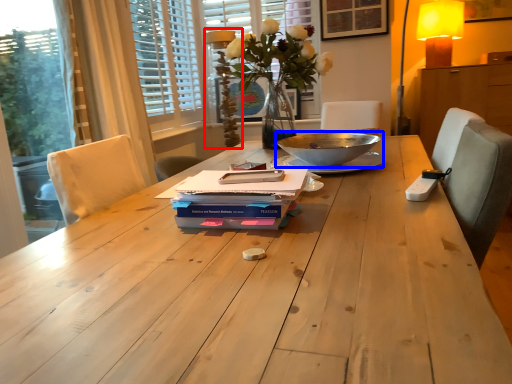
Question: Which object appears farthest to the camera in this image, table lamp (highlighted by a red box) or bowl (highlighted by a blue box)?

Choices:
 (A) table lamp
 (B) bowl

Answer: (A)